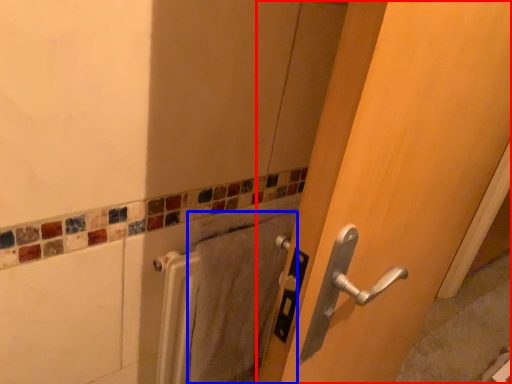
Question: Which point is further to the camera, door (highlighted by a red box) or bath towel (highlighted by a blue box)?

Choices:
 (A) door
 (B) bath towel

Answer: (B)